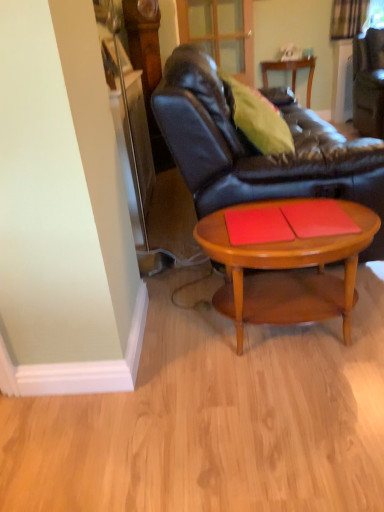
Question: Is leather couch at center shorter than light brown wood coffee table at center?

Choices:
 (A) yes
 (B) no

Answer: (B)

Question: Is leather couch at center positioned in front of light brown wood coffee table at center?

Choices:
 (A) no
 (B) yes

Answer: (A)

Question: Is leather couch at center positioned beyond the bounds of light brown wood coffee table at center?

Choices:
 (A) no
 (B) yes

Answer: (B)

Question: From a real-world perspective, does leather couch at center stand above light brown wood coffee table at center?

Choices:
 (A) yes
 (B) no

Answer: (A)

Question: Can you confirm if leather couch at center is positioned to the left of light brown wood coffee table at center?

Choices:
 (A) yes
 (B) no

Answer: (B)

Question: Does leather couch at center touch light brown wood coffee table at center?

Choices:
 (A) yes
 (B) no

Answer: (B)

Question: Considering the relative sizes of red matte placemat at center, the second plank viewed from the left, and light brown wood coffee table at center in the image provided, is red matte placemat at center, the second plank viewed from the left, bigger than light brown wood coffee table at center?

Choices:
 (A) yes
 (B) no

Answer: (B)

Question: Are red matte placemat at center, the first plank from the right, and light brown wood coffee table at center located far from each other?

Choices:
 (A) yes
 (B) no

Answer: (B)

Question: Can you confirm if red matte placemat at center, the second plank viewed from the left, is smaller than light brown wood coffee table at center?

Choices:
 (A) no
 (B) yes

Answer: (B)

Question: Is light brown wood coffee table at center completely or partially inside red matte placemat at center, the second plank viewed from the left?

Choices:
 (A) no
 (B) yes

Answer: (A)

Question: From the image's perspective, is red matte placemat at center, the first plank from the right, under light brown wood coffee table at center?

Choices:
 (A) yes
 (B) no

Answer: (B)

Question: Is red matte placemat at center, the first plank from the right, oriented towards light brown wood coffee table at center?

Choices:
 (A) yes
 (B) no

Answer: (B)

Question: Considering the relative positions of red matte placemat at center, the first plank from the right, and leather couch at center in the image provided, is red matte placemat at center, the first plank from the right, to the left of leather couch at center from the viewer's perspective?

Choices:
 (A) yes
 (B) no

Answer: (B)